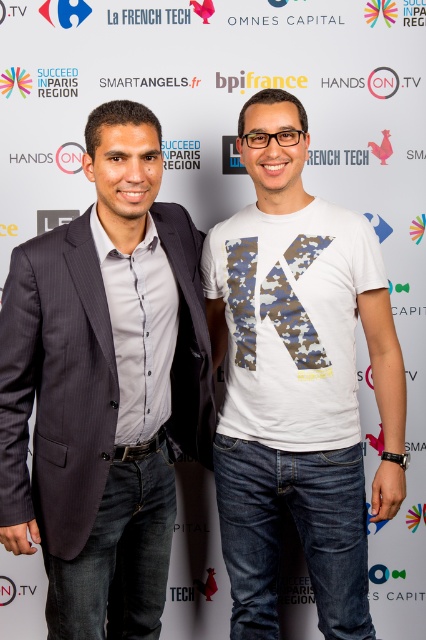
You are a photographer who needs to adjust the lighting for the dark gray pinstripe suit at left in the image. Based on its position, where should you place the light to ensure it is well lit?

The dark gray pinstripe suit at left is positioned at point (104, 387), so placing the light in that area would ensure proper lighting.

You are a photographer adjusting your camera settings to focus on two points in the image. The first point is labeled as point (x=333, y=209) and the second is point (x=275, y=300). Which point should you focus on first if you want to ensure the closest object is in sharp focus?

Point (x=333, y=209) is further to the camera than point (x=275, y=300). Therefore, you should focus on point (x=333, y=209) first to ensure the closest object is in sharp focus.